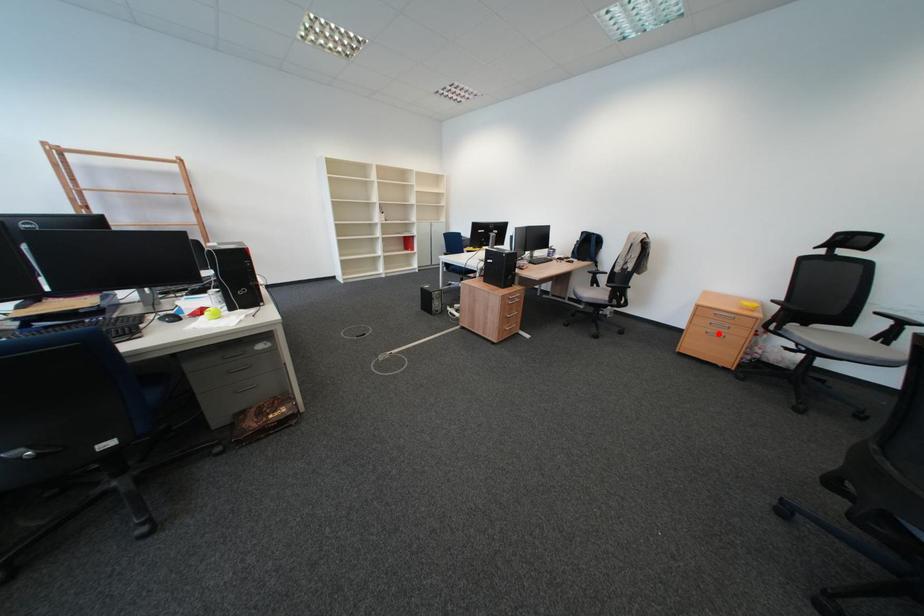
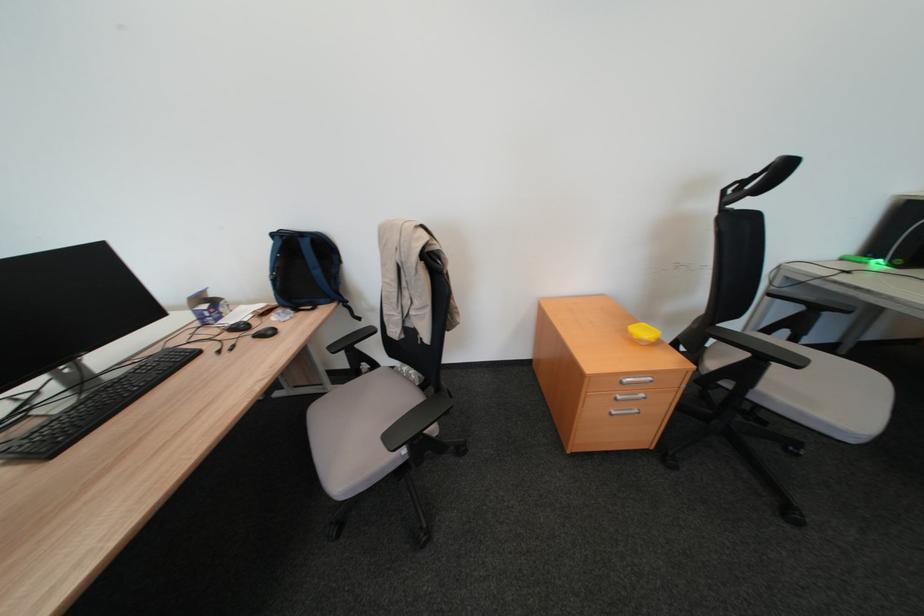
Locate, in the second image, the point that corresponds to the highlighted location in the first image.

(623, 416)